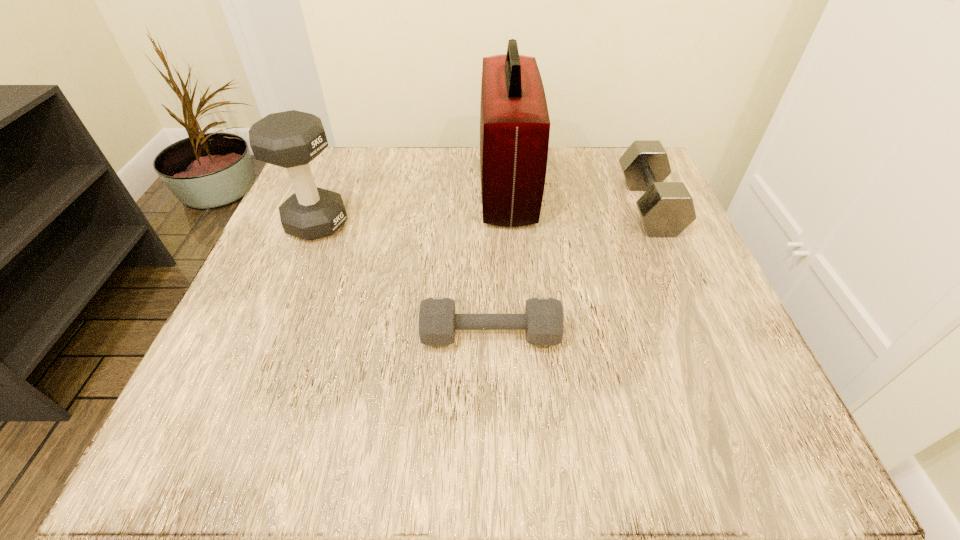
This screenshot has width=960, height=540. I want to click on free spot located on the right of the leftmost object, so click(374, 224).

Where is `free point located 0.300m on the left of the second shortest dumbbell`? free point located 0.300m on the left of the second shortest dumbbell is located at coordinates (480, 206).

Find the location of a particular element. This screenshot has width=960, height=540. vacant space situated 0.270m on the back of the nearest object is located at coordinates (488, 214).

The height and width of the screenshot is (540, 960). Find the location of `the first aid kit that is at the far edge`. the first aid kit that is at the far edge is located at coordinates (514, 121).

The width and height of the screenshot is (960, 540). I want to click on object at the left edge, so [291, 139].

What are the coordinates of `object at the right edge` in the screenshot? It's located at (666, 209).

The image size is (960, 540). Find the location of `object at the far left corner`. object at the far left corner is located at coordinates (291, 139).

Find the location of a particular element. object located at the far right corner is located at coordinates (666, 209).

Where is `vacant space at the far edge of the desktop`? This screenshot has height=540, width=960. vacant space at the far edge of the desktop is located at coordinates (386, 180).

At what (x,y) coordinates should I click in order to perform the action: click on free space at the near edge. Please return your answer as a coordinate pair (x, y). Image resolution: width=960 pixels, height=540 pixels. Looking at the image, I should click on (317, 430).